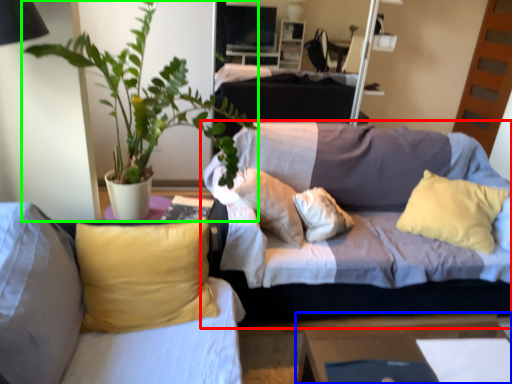
Question: Which object is positioned closest to studio couch (highlighted by a red box)? Select from table (highlighted by a blue box) and houseplant (highlighted by a green box).

Choices:
 (A) table
 (B) houseplant

Answer: (A)